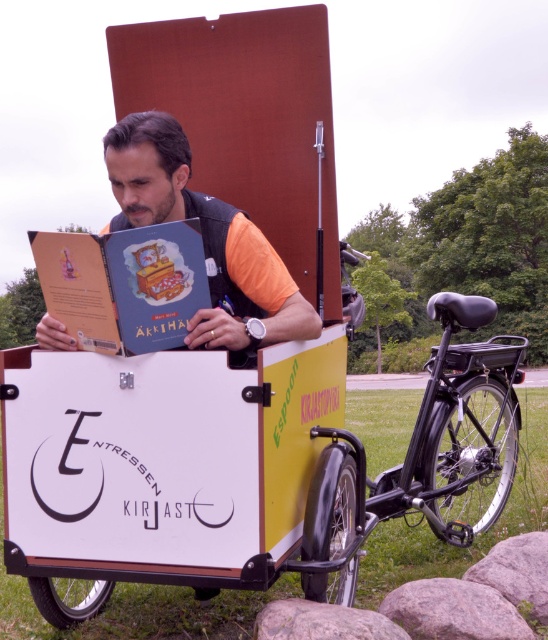
Which of these two, matte black book at center or hardcover book at center, stands shorter?

hardcover book at center is shorter.

Is point (292, 339) farther from camera compared to point (115, 292)?

That is True.

Between point (270, 266) and point (157, 230), which one is positioned behind?

Positioned behind is point (270, 266).

Identify the location of matte black book at center. (206, 237).

What are the coordinates of `black matte bicycle at center` in the screenshot? It's located at (424, 456).

Between black matte bicycle at center and matte black book at center, which one appears on the left side from the viewer's perspective?

matte black book at center

You are a GUI agent. You are given a task and a screenshot of the screen. Output one action in this format:
    pyautogui.click(x=<x>, y=<y>)
    Task: Click on the black matte bicycle at center
    The image size is (548, 640).
    Given the screenshot: What is the action you would take?
    point(424,456)

Who is more forward, (355, 452) or (127, 280)?

Positioned in front is point (127, 280).

Does black matte bicycle at center have a lesser width compared to hardcover book at center?

No.

At what (x,y) coordinates should I click in order to perform the action: click on black matte bicycle at center. Please return your answer as a coordinate pair (x, y). Looking at the image, I should click on (424, 456).